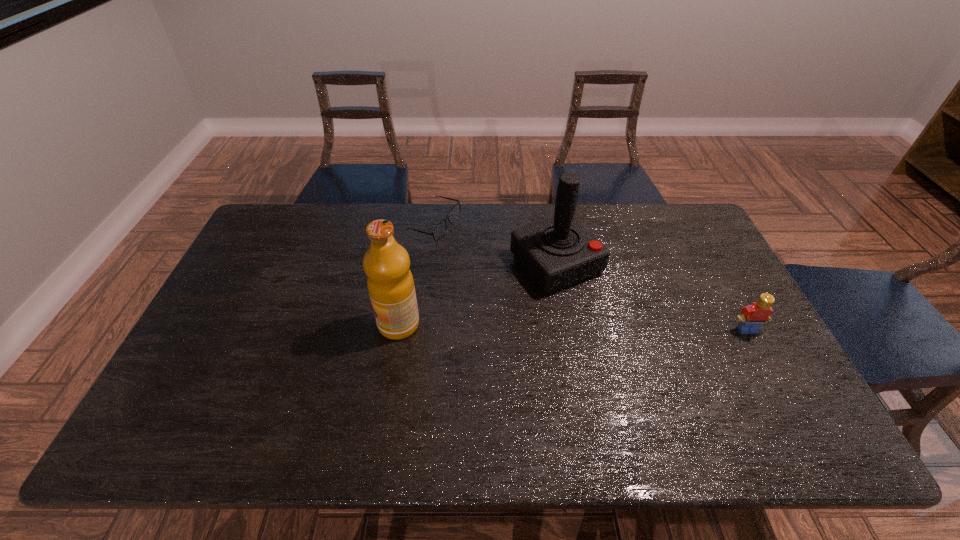
Locate an element on the screen. This screenshot has height=540, width=960. blank space at the left edge is located at coordinates (278, 263).

Identify the location of vacant space at the right edge of the desktop. Image resolution: width=960 pixels, height=540 pixels. (735, 315).

Find the location of `vacant space that's between the fruit juice and the joystick`. vacant space that's between the fruit juice and the joystick is located at coordinates (477, 294).

Identify the location of empty location between the third object from left to right and the second shortest object. (652, 296).

The width and height of the screenshot is (960, 540). I want to click on free space between the shortest object and the fruit juice, so click(x=417, y=274).

Where is `empty location between the spectacles and the joystick`? This screenshot has width=960, height=540. empty location between the spectacles and the joystick is located at coordinates (495, 244).

At what (x,y) coordinates should I click in order to perform the action: click on free space between the fruit juice and the third tallest object. Please return your answer as a coordinate pair (x, y). The image size is (960, 540). Looking at the image, I should click on (573, 327).

This screenshot has width=960, height=540. Find the location of `free spot between the spectacles and the joystick`. free spot between the spectacles and the joystick is located at coordinates (495, 244).

Image resolution: width=960 pixels, height=540 pixels. What are the coordinates of `vacant area that lies between the joystick and the second shortest object` in the screenshot? It's located at (652, 296).

Where is `unoccupied area between the fruit juice and the rightmost object`? The width and height of the screenshot is (960, 540). unoccupied area between the fruit juice and the rightmost object is located at coordinates (573, 327).